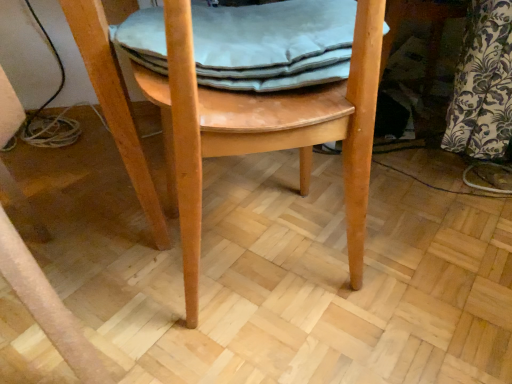
I want to click on free space to the back side of light brown wood chair at center, so click(266, 172).